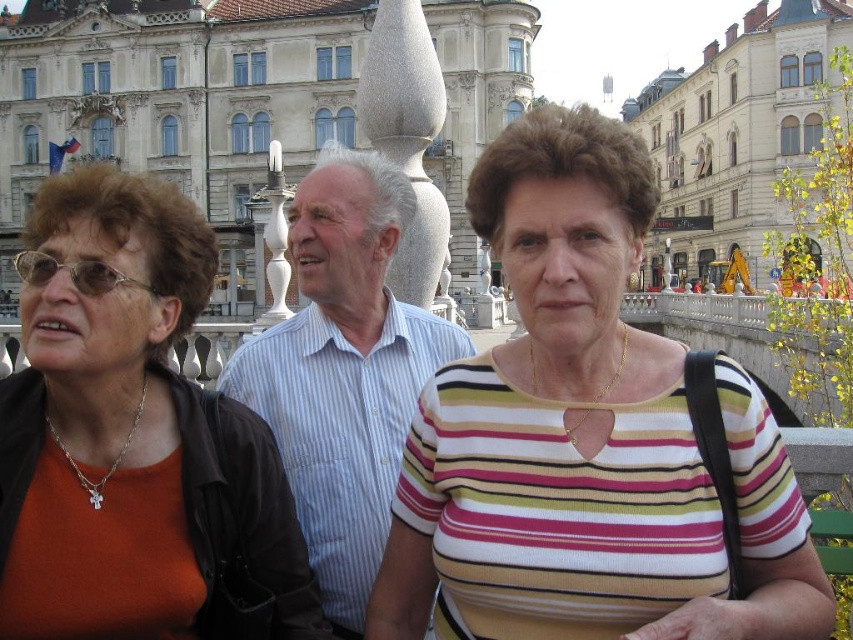
Question: From the image, what is the correct spatial relationship of matte black jacket at left in relation to white striped shirt at center?

Choices:
 (A) below
 (B) above

Answer: (A)

Question: Which object is positioned farthest from the striped knit top at center?

Choices:
 (A) matte black jacket at left
 (B) white striped shirt at center

Answer: (A)

Question: Which of the following is the closest to the observer?

Choices:
 (A) (306, 346)
 (B) (78, 420)
 (C) (553, 632)

Answer: (C)

Question: Is matte black jacket at left positioned at the back of white striped shirt at center?

Choices:
 (A) no
 (B) yes

Answer: (A)

Question: Can you confirm if striped knit top at center is positioned to the right of white striped shirt at center?

Choices:
 (A) yes
 (B) no

Answer: (A)

Question: Which object appears closest to the camera in this image?

Choices:
 (A) striped knit top at center
 (B) matte black jacket at left
 (C) white striped shirt at center

Answer: (A)